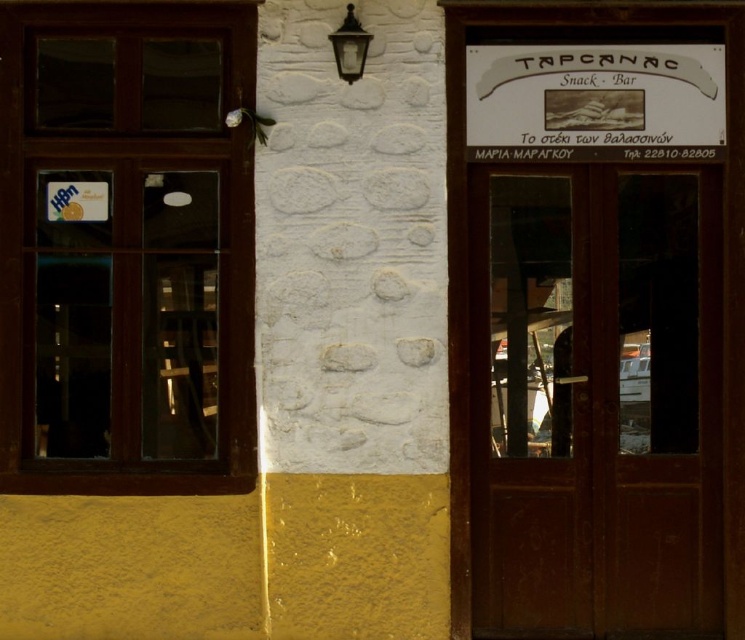
In the scene shown: You are standing in front of the building shown in the image. The brown wooden door at right is represented by point (x=596, y=401). If you want to enter the building, where should you walk towards?

You should walk towards the brown wooden door at right located at point (x=596, y=401) to enter the building.

You are a delivery person with a 24 inch wide box. You need to carry this box through the entrance of the building. The entrance has the brown wooden door at right and the white paper sign at upper center. Can you fit the box through the entrance without tilting it?

The distance between the brown wooden door at right and the white paper sign at upper center is 25.64 inches. Since the box is only 24 inches wide, it should fit through the entrance without tilting.